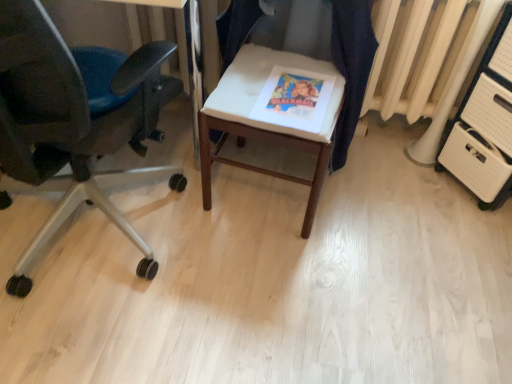
This screenshot has width=512, height=384. I want to click on free space in front of white fabric chair at center, so click(274, 273).